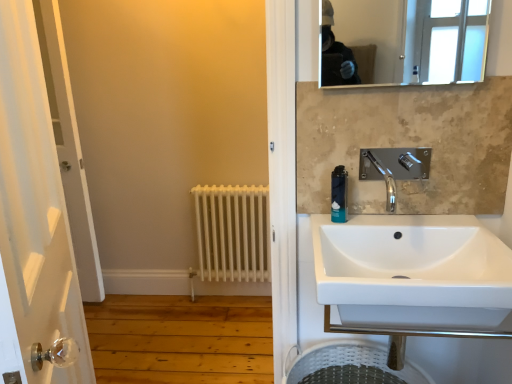
Question: From the image's perspective, is black plastic soap dispenser at upper right positioned above or below white ceramic sink at center?

Choices:
 (A) below
 (B) above

Answer: (B)

Question: Considering the positions of black plastic soap dispenser at upper right and white ceramic sink at center in the image, is black plastic soap dispenser at upper right taller or shorter than white ceramic sink at center?

Choices:
 (A) short
 (B) tall

Answer: (A)

Question: Which object is the closest to the white plastic laundry basket at lower right?

Choices:
 (A) white glossy door at left
 (B) black plastic soap dispenser at upper right
 (C) white ceramic sink at center
 (D) chrome metallic faucet at upper right
 (E) white matte radiator at lower left

Answer: (C)

Question: Based on their relative distances, which object is nearer to the white glossy door at left?

Choices:
 (A) clear glass mirror at upper center
 (B) chrome metallic faucet at upper right
 (C) black plastic soap dispenser at upper right
 (D) white plastic laundry basket at lower right
 (E) white ceramic sink at center

Answer: (E)